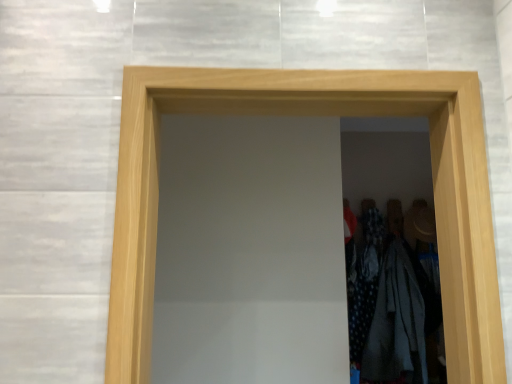
The image size is (512, 384). What do you see at coordinates (389, 303) in the screenshot?
I see `white cotton shirt at right` at bounding box center [389, 303].

Where is `polka dot fabric dress at right`? The height and width of the screenshot is (384, 512). polka dot fabric dress at right is located at coordinates (364, 279).

Where is `natural wood door at center`? The image size is (512, 384). natural wood door at center is located at coordinates (313, 115).

You are a GUI agent. You are given a task and a screenshot of the screen. Output one action in this format:
    pyautogui.click(x=<x>, y=<y>)
    Task: Click on the white cotton shirt at right
    The height and width of the screenshot is (384, 512).
    Given the screenshot: What is the action you would take?
    coord(389,303)

Considering the positions of objects polka dot fabric dress at right and natural wood door at center in the image provided, who is behind, polka dot fabric dress at right or natural wood door at center?

polka dot fabric dress at right is further from the camera.

Is the surface of polka dot fabric dress at right in direct contact with natural wood door at center?

They are not placed beside each other.

Visually, is polka dot fabric dress at right positioned to the left or to the right of natural wood door at center?

polka dot fabric dress at right is to the right of natural wood door at center.

In the scene shown: Is white cotton shirt at right in front of natural wood door at center?

No, it is not.

From a real-world perspective, which is physically below, white cotton shirt at right or natural wood door at center?

white cotton shirt at right, from a real-world perspective.

Is white cotton shirt at right not inside natural wood door at center?

Yes, white cotton shirt at right is outside of natural wood door at center.

Is point (394, 313) closer to camera compared to point (155, 199)?

No, (394, 313) is further to viewer.

From the image's perspective, is white cotton shirt at right below polka dot fabric dress at right?

Correct, white cotton shirt at right appears lower than polka dot fabric dress at right in the image.

Is white cotton shirt at right wider or thinner than polka dot fabric dress at right?

Considering their sizes, white cotton shirt at right looks broader than polka dot fabric dress at right.

Is white cotton shirt at right looking in the opposite direction of polka dot fabric dress at right?

No, white cotton shirt at right is not facing away from polka dot fabric dress at right.

From a real-world perspective, is natural wood door at center positioned under polka dot fabric dress at right based on gravity?

No.

From the image's perspective, which is above, natural wood door at center or polka dot fabric dress at right?

natural wood door at center appears higher in the image.

Find the location of a particular element. door to the left of polka dot fabric dress at right is located at coordinates (313, 115).

Who is taller, natural wood door at center or polka dot fabric dress at right?

With more height is polka dot fabric dress at right.

From the picture: Which of these two, natural wood door at center or white cotton shirt at right, is smaller?

With smaller size is white cotton shirt at right.

From the image's perspective, which one is positioned lower, natural wood door at center or white cotton shirt at right?

From the image's view, white cotton shirt at right is below.

Which is in front, point (300, 114) or point (365, 242)?

Point (300, 114)

How different are the orientations of natural wood door at center and white cotton shirt at right in degrees?

There is a 3.47-degree angle between the facing directions of natural wood door at center and white cotton shirt at right.

Is polka dot fabric dress at right positioned far away from white cotton shirt at right?

polka dot fabric dress at right is near white cotton shirt at right, not far away.

From the image's perspective, is polka dot fabric dress at right positioned above or below white cotton shirt at right?

From the image's perspective, polka dot fabric dress at right appears above white cotton shirt at right.

Considering the sizes of objects polka dot fabric dress at right and white cotton shirt at right in the image provided, who is shorter, polka dot fabric dress at right or white cotton shirt at right?

polka dot fabric dress at right is shorter.

Is point (367, 314) closer or farther from the camera than point (401, 326)?

Clearly, point (367, 314) is more distant from the camera than point (401, 326).

The height and width of the screenshot is (384, 512). I want to click on door lying above the polka dot fabric dress at right (from the image's perspective), so click(313, 115).

There is a white cotton shirt at right. Where is `door above it (from a real-world perspective)`? The image size is (512, 384). door above it (from a real-world perspective) is located at coordinates click(313, 115).

Based on their spatial positions, is polka dot fabric dress at right or natural wood door at center closer to white cotton shirt at right?

Among the two, polka dot fabric dress at right is located nearer to white cotton shirt at right.

Looking at the image, which one is located further to polka dot fabric dress at right, natural wood door at center or white cotton shirt at right?

Among the two, natural wood door at center is located further to polka dot fabric dress at right.

Considering their positions, is natural wood door at center positioned closer to white cotton shirt at right than polka dot fabric dress at right?

polka dot fabric dress at right lies closer to white cotton shirt at right than the other object.

Which object lies nearer to the anchor point polka dot fabric dress at right, white cotton shirt at right or natural wood door at center?

Based on the image, white cotton shirt at right appears to be nearer to polka dot fabric dress at right.

From the image, which object appears to be nearer to natural wood door at center, white cotton shirt at right or polka dot fabric dress at right?

white cotton shirt at right lies closer to natural wood door at center than the other object.

Looking at the image, which one is located further to natural wood door at center, polka dot fabric dress at right or white cotton shirt at right?

Among the two, polka dot fabric dress at right is located further to natural wood door at center.

Locate an element on the screen. This screenshot has width=512, height=384. laundry between natural wood door at center and polka dot fabric dress at right along the z-axis is located at coordinates (389, 303).